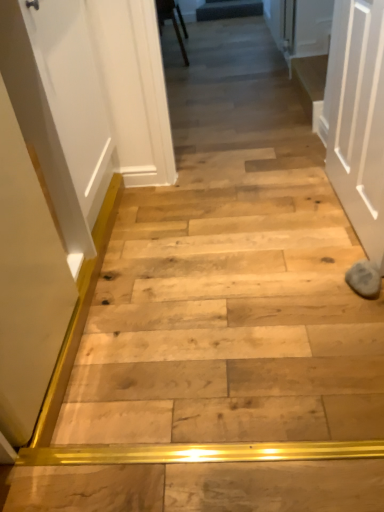
Where is `blank space to the left of white matte door at right`? The width and height of the screenshot is (384, 512). blank space to the left of white matte door at right is located at coordinates 251,225.